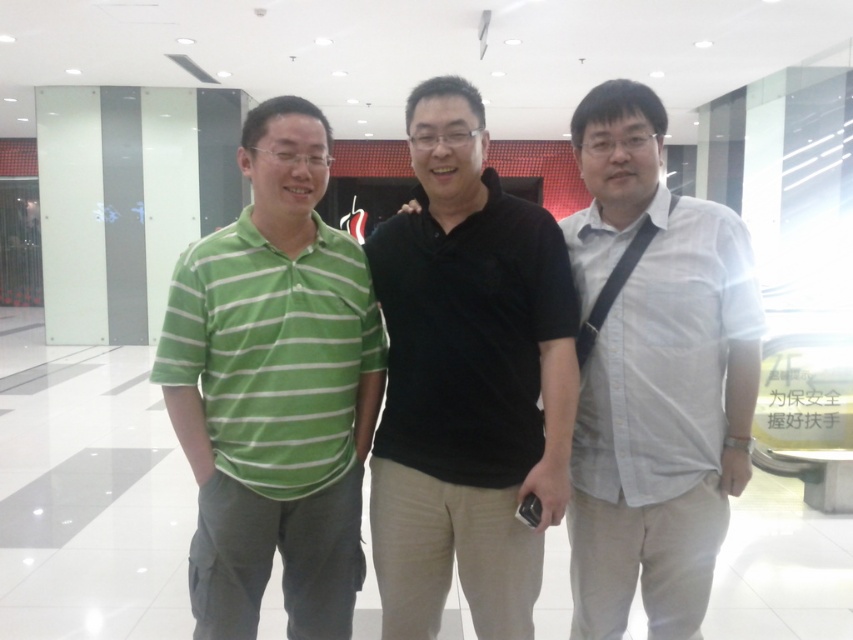
Question: Is black matte shirt at center below green striped polo shirt at left?

Choices:
 (A) yes
 (B) no

Answer: (B)

Question: Is green striped polo shirt at left smaller than white cotton shirt at right?

Choices:
 (A) yes
 (B) no

Answer: (B)

Question: Estimate the real-world distances between objects in this image. Which object is closer to the white cotton shirt at right?

Choices:
 (A) green striped polo shirt at left
 (B) black matte shirt at center

Answer: (B)

Question: Which of the following is the farthest from the observer?

Choices:
 (A) (697, 404)
 (B) (427, 234)
 (C) (209, 540)

Answer: (B)

Question: Which object appears farthest from the camera in this image?

Choices:
 (A) black matte shirt at center
 (B) green striped polo shirt at left
 (C) white cotton shirt at right

Answer: (C)

Question: Does black matte shirt at center appear over green striped polo shirt at left?

Choices:
 (A) yes
 (B) no

Answer: (A)